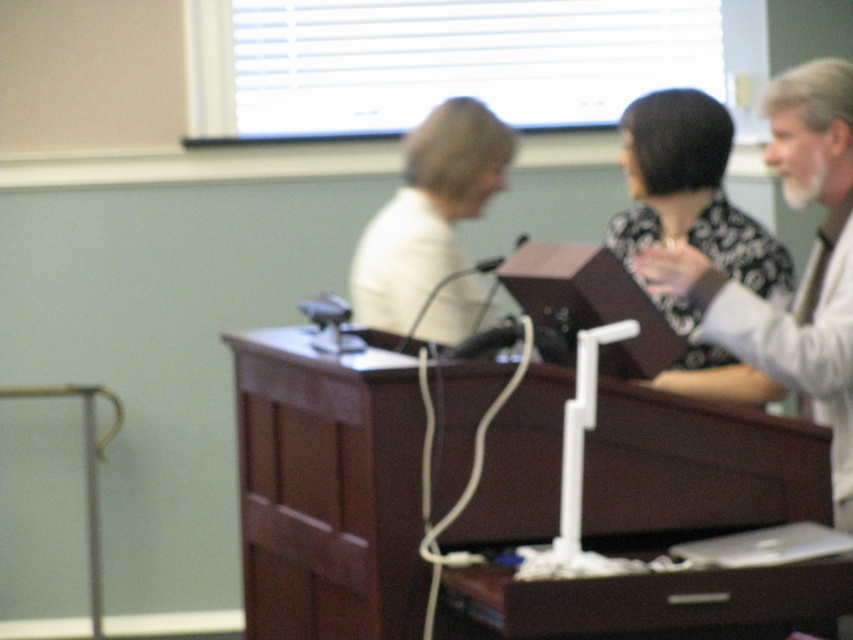
You are standing in the room and want to place a small plant on the podium. There are two points marked on the podium where you can place it. The points are labeled as point 1 at coordinates point (468, 422) and point 2 at coordinates point (782, 374). Which point is closer to you so that the plant will be more visible to the audience?

Point (468, 422) is closer to the viewer than point (782, 374). Therefore, placing the plant at point (468, 422) will make it more visible to the audience.

Consider the image. You are a photographer setting up for an event. You need to adjust the height of your camera to capture both the dark wood table at center and the white textured shirt at upper right clearly. Which object should you focus on first to ensure both are in frame?

The dark wood table at center is shorter than the white textured shirt at upper right, so you should focus on the white textured shirt at upper right first to ensure both are in frame.